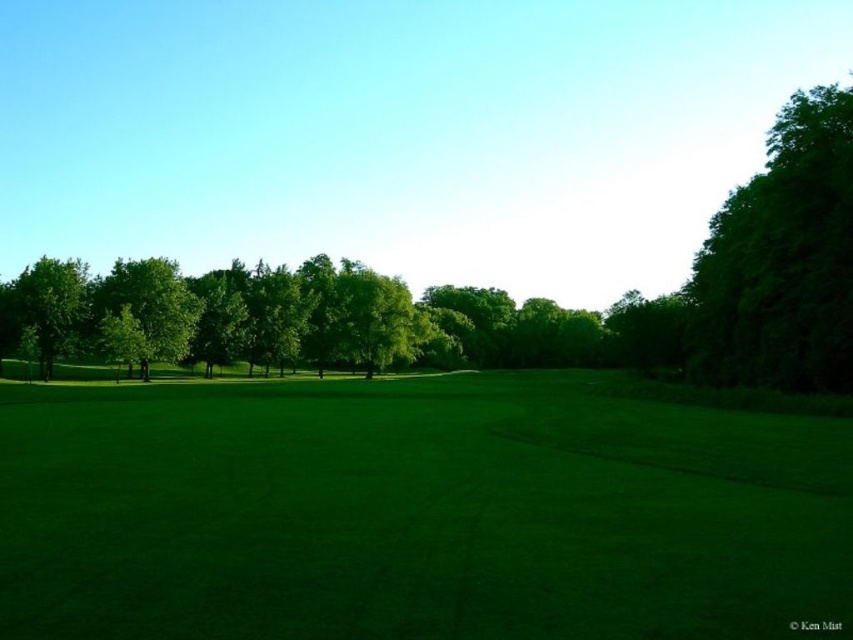
Question: Can you confirm if green grass at center is thinner than green leafy tree at center?

Choices:
 (A) yes
 (B) no

Answer: (B)

Question: Which of the following is the closest to the observer?

Choices:
 (A) (82, 310)
 (B) (469, 570)

Answer: (B)

Question: Which point is closer to the camera?

Choices:
 (A) (144, 595)
 (B) (770, 266)
 (C) (144, 305)
 (D) (22, 307)

Answer: (A)

Question: Does green grass at center have a lesser width compared to green leafy tree at center?

Choices:
 (A) no
 (B) yes

Answer: (A)

Question: Which object is the farthest from the green leafy tree at left?

Choices:
 (A) green leafy tree at right
 (B) green leafy tree at center
 (C) green grass at center

Answer: (A)

Question: Does green leafy tree at center have a greater width compared to green leafy tree at left?

Choices:
 (A) no
 (B) yes

Answer: (B)